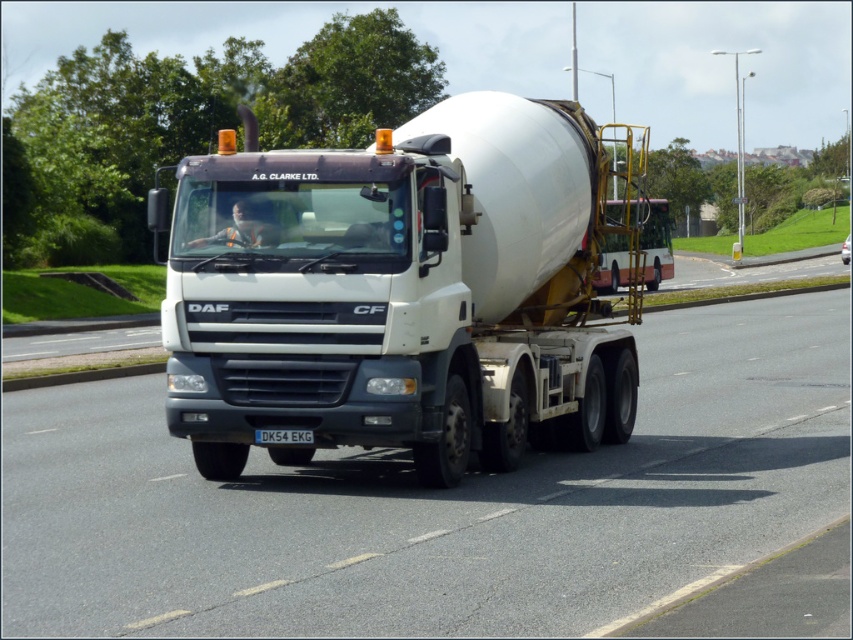
You are a traffic officer observing a road with two trucks at the center. The white glossy concrete mixer truck at center and the white matte trailer truck at center. Which truck is positioned lower on the road?

The white glossy concrete mixer truck at center is located below the white matte trailer truck at center, so it is positioned lower on the road.

You are a traffic officer observing two trucks on a highway. You need to determine if they are maintaining a safe distance. The safe distance between two trucks on a highway is 10 feet. Are the white glossy concrete mixer truck at center and the white matte trailer truck at center maintaining a safe distance?

The white glossy concrete mixer truck at center is 9.35 feet away from white matte trailer truck at center. Since the safe distance is 10 feet, they are not maintaining a safe distance as the distance is less than required.